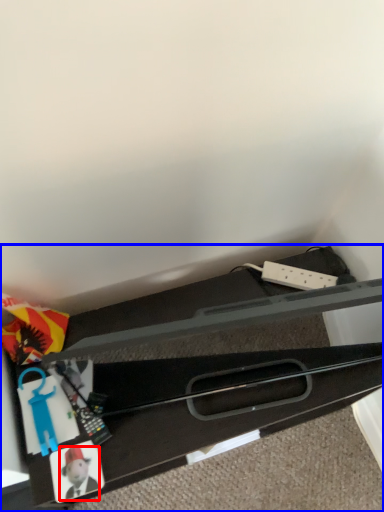
Question: Which object appears farthest to the camera in this image, toy (highlighted by a red box) or furniture (highlighted by a blue box)?

Choices:
 (A) toy
 (B) furniture

Answer: (A)